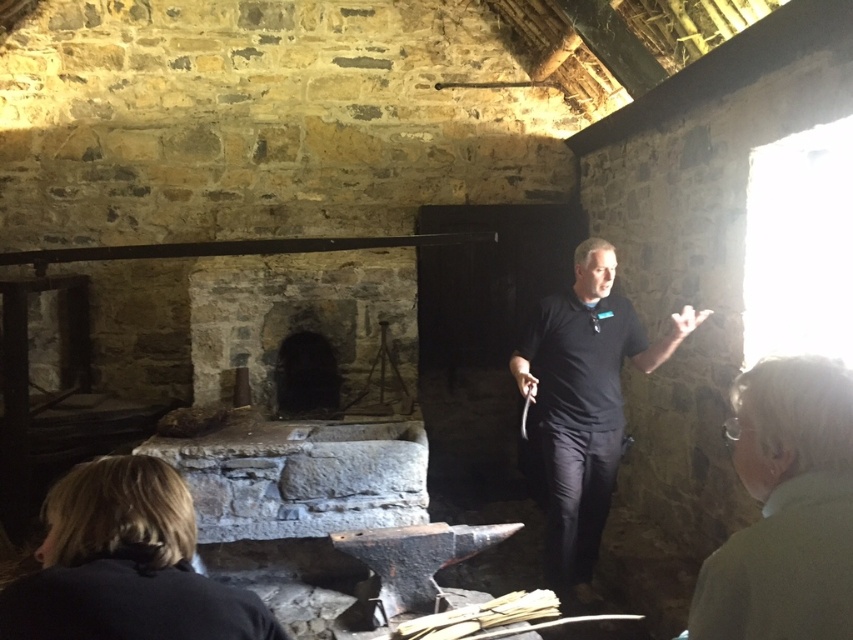
You are a blacksmith entering your workshop and notice a gray wool sweater at upper right and a wooden beam at center. Which object is narrower?

The gray wool sweater at upper right is narrower than the wooden beam at center.

You are a customer entering the blacksmith workshop and see the blonde hair at lower left and the dark stone fireplace at center. Which object is closer to the entrance?

The blonde hair at lower left is closer to the entrance because it is located below the dark stone fireplace at center, indicating it is positioned lower and nearer to the entrance area.

You are a blacksmith wearing a gray wool sweater at upper right and you want to reach for a tool on the workbench that is 40 inches away from you. Can you comfortably reach it?

The gray wool sweater at upper right and viewer are 38.47 inches apart from each other. Since the tool is 40 inches away, it is slightly out of your comfortable reach.